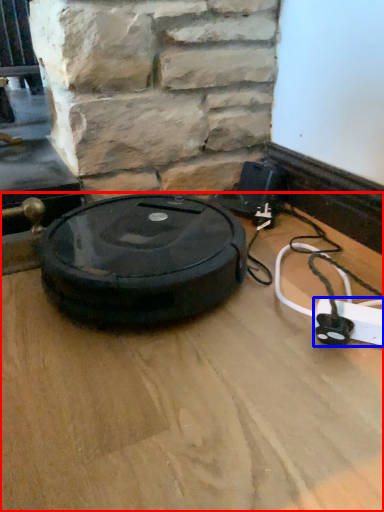
Question: Which object appears farthest to the camera in this image, surface (highlighted by a red box) or extension cord (highlighted by a blue box)?

Choices:
 (A) surface
 (B) extension cord

Answer: (B)